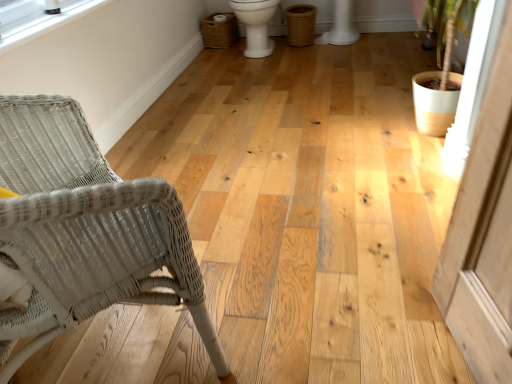
Where is `clear plastic window screen at upper left`? clear plastic window screen at upper left is located at coordinates point(38,19).

Describe the element at coordinates (219, 30) in the screenshot. I see `woven brown laundry basket at upper center` at that location.

Find the location of a particular element. The image size is (512, 384). clear plastic window screen at upper left is located at coordinates (38, 19).

Measure the distance between white wicker chair at left and white glossy toilet bowl at center.

A distance of 8.50 feet exists between white wicker chair at left and white glossy toilet bowl at center.

In the scene shown: Does white wicker chair at left touch white glossy toilet bowl at center?

They are not placed beside each other.

What's the angular difference between white wicker chair at left and white glossy toilet bowl at center's facing directions?

The facing directions of white wicker chair at left and white glossy toilet bowl at center are 136 degrees apart.

Is white wicker chair at left to the right of white glossy toilet bowl at center from the viewer's perspective?

In fact, white wicker chair at left is to the left of white glossy toilet bowl at center.

From the image's perspective, which is below, white wicker chair at left or clear plastic window screen at upper left?

From the image's view, white wicker chair at left is below.

Which of these two, white wicker chair at left or clear plastic window screen at upper left, is bigger?

Bigger between the two is white wicker chair at left.

Considering the sizes of objects white wicker chair at left and clear plastic window screen at upper left in the image provided, who is wider, white wicker chair at left or clear plastic window screen at upper left?

white wicker chair at left is wider.

Considering the positions of points (54, 107) and (72, 17), is point (54, 107) closer to camera compared to point (72, 17)?

That is True.

Which object is positioned more to the left, white wicker chair at left or woven brown laundry basket at upper center?

From the viewer's perspective, white wicker chair at left appears more on the left side.

Is white wicker chair at left not near woven brown laundry basket at upper center?

Yes, white wicker chair at left and woven brown laundry basket at upper center are quite far apart.

Is white wicker chair at left positioned beyond the bounds of woven brown laundry basket at upper center?

Yes, white wicker chair at left is outside of woven brown laundry basket at upper center.

Which of these two, white wicker chair at left or woven brown laundry basket at upper center, is smaller?

Smaller between the two is woven brown laundry basket at upper center.

Which object is thinner, clear plastic window screen at upper left or white wicker chair at left?

clear plastic window screen at upper left is thinner.

Can you tell me how much clear plastic window screen at upper left and white wicker chair at left differ in facing direction?

43.6 degrees.

From the image's perspective, would you say clear plastic window screen at upper left is positioned over white wicker chair at left?

Correct, clear plastic window screen at upper left appears higher than white wicker chair at left in the image.

From a real-world perspective, between woven brown laundry basket at upper center and white glossy toilet bowl at center, who is vertically lower?

In real-world perspective, woven brown laundry basket at upper center is lower.

Between woven brown laundry basket at upper center and white glossy toilet bowl at center, which one is positioned in front?

Positioned in front is white glossy toilet bowl at center.

Based on the photo, considering the relative sizes of woven brown laundry basket at upper center and white glossy toilet bowl at center in the image provided, is woven brown laundry basket at upper center taller than white glossy toilet bowl at center?

No.

Considering the relative sizes of woven brown laundry basket at upper center and white glossy toilet bowl at center in the image provided, is woven brown laundry basket at upper center smaller than white glossy toilet bowl at center?

Correct, woven brown laundry basket at upper center occupies less space than white glossy toilet bowl at center.

Could clear plastic window screen at upper left be considered to be inside woven brown laundry basket at upper center?

No.

Based on the photo, from a real-world perspective, does woven brown laundry basket at upper center stand above clear plastic window screen at upper left?

No, from a real-world perspective, woven brown laundry basket at upper center is not above clear plastic window screen at upper left.

At what (x,y) coordinates should I click in order to perform the action: click on window screen in front of the woven brown laundry basket at upper center. Please return your answer as a coordinate pair (x, y). Looking at the image, I should click on (38, 19).

Considering the positions of objects woven brown laundry basket at upper center and white wicker chair at left in the image provided, who is more to the right, woven brown laundry basket at upper center or white wicker chair at left?

woven brown laundry basket at upper center.

Can you tell me how much woven brown laundry basket at upper center and white wicker chair at left differ in facing direction?

The angle between the facing direction of woven brown laundry basket at upper center and the facing direction of white wicker chair at left is 144 degrees.

Can you confirm if woven brown laundry basket at upper center is thinner than white wicker chair at left?

Yes, woven brown laundry basket at upper center is thinner than white wicker chair at left.

From a real-world perspective, relative to white wicker chair at left, is woven brown laundry basket at upper center vertically above or below?

In terms of real-world spatial position, woven brown laundry basket at upper center is below white wicker chair at left.

Locate an element on the screen. The height and width of the screenshot is (384, 512). chair on the left side of white glossy toilet bowl at center is located at coordinates (86, 230).

Locate an element on the screen. Image resolution: width=512 pixels, height=384 pixels. chair in front of the clear plastic window screen at upper left is located at coordinates (86, 230).

Based on their spatial positions, is clear plastic window screen at upper left or white wicker chair at left closer to white glossy toilet bowl at center?

The object closer to white glossy toilet bowl at center is clear plastic window screen at upper left.

Looking at the image, which one is located further to white wicker chair at left, white glossy toilet bowl at center or clear plastic window screen at upper left?

The object further to white wicker chair at left is white glossy toilet bowl at center.

From the image, which object appears to be nearer to clear plastic window screen at upper left, white wicker chair at left or woven brown laundry basket at upper center?

white wicker chair at left.

Considering their positions, is white glossy toilet bowl at center positioned closer to woven brown laundry basket at upper center than white wicker chair at left?

Among the two, white glossy toilet bowl at center is located nearer to woven brown laundry basket at upper center.

Consider the image. Looking at the image, which one is located closer to clear plastic window screen at upper left, white wicker chair at left or white glossy toilet bowl at center?

white wicker chair at left is closer to clear plastic window screen at upper left.

Which object lies further to the anchor point white wicker chair at left, white glossy toilet bowl at center or woven brown laundry basket at upper center?

woven brown laundry basket at upper center.

When comparing their distances from clear plastic window screen at upper left, does white glossy toilet bowl at center or woven brown laundry basket at upper center seem further?

woven brown laundry basket at upper center.

Looking at the image, which one is located closer to clear plastic window screen at upper left, woven brown laundry basket at upper center or white wicker chair at left?

white wicker chair at left is positioned closer to the anchor clear plastic window screen at upper left.

Identify the location of toilet bowl located between white wicker chair at left and woven brown laundry basket at upper center in the depth direction. (256, 25).

Locate an element on the screen. This screenshot has height=384, width=512. toilet bowl located between clear plastic window screen at upper left and woven brown laundry basket at upper center in the depth direction is located at coordinates (256, 25).

This screenshot has height=384, width=512. I want to click on window screen located between white wicker chair at left and woven brown laundry basket at upper center in the depth direction, so click(x=38, y=19).

This screenshot has height=384, width=512. I want to click on window screen between white wicker chair at left and white glossy toilet bowl at center along the z-axis, so click(x=38, y=19).